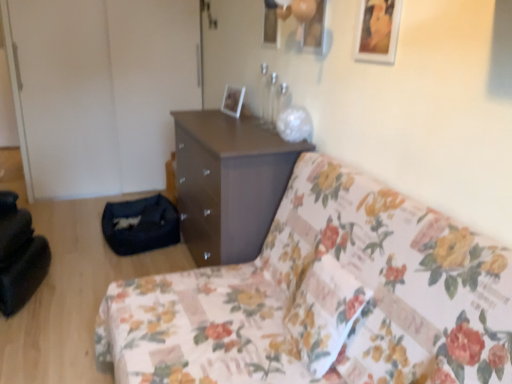
Question: Can you confirm if floral fabric couch at center is positioned to the right of white glossy picture frame at upper center, marked as the 2th picture frame in a right-to-left arrangement?

Choices:
 (A) yes
 (B) no

Answer: (A)

Question: Considering the relative sizes of floral fabric couch at center and white glossy picture frame at upper center, which appears as the first picture frame when viewed from the left, in the image provided, is floral fabric couch at center wider than white glossy picture frame at upper center, which appears as the first picture frame when viewed from the left,?

Choices:
 (A) no
 (B) yes

Answer: (B)

Question: Is floral fabric couch at center beside white glossy picture frame at upper center, which appears as the first picture frame when viewed from the left?

Choices:
 (A) yes
 (B) no

Answer: (B)

Question: From the image's perspective, is floral fabric couch at center located beneath white glossy picture frame at upper center, positioned as the first picture frame in back-to-front order?

Choices:
 (A) no
 (B) yes

Answer: (B)

Question: Is floral fabric couch at center turned away from white glossy picture frame at upper center, which appears as the first picture frame when viewed from the left?

Choices:
 (A) yes
 (B) no

Answer: (B)

Question: Is point (234, 124) closer or farther from the camera than point (228, 102)?

Choices:
 (A) farther
 (B) closer

Answer: (B)

Question: Is matte brown chest of drawers at center spatially inside white glossy picture frame at upper center, acting as the 2th picture frame starting from the front, or outside of it?

Choices:
 (A) inside
 (B) outside

Answer: (B)

Question: In the image, is matte brown chest of drawers at center on the left side or the right side of white glossy picture frame at upper center, marked as the 2th picture frame in a right-to-left arrangement?

Choices:
 (A) right
 (B) left

Answer: (B)

Question: Based on their sizes in the image, would you say matte brown chest of drawers at center is bigger or smaller than white glossy picture frame at upper center, marked as the 2th picture frame in a right-to-left arrangement?

Choices:
 (A) big
 (B) small

Answer: (A)

Question: Is point (287, 193) positioned closer to the camera than point (248, 254)?

Choices:
 (A) farther
 (B) closer

Answer: (B)

Question: Considering their positions, is floral fabric couch at center located in front of or behind matte brown chest of drawers at center?

Choices:
 (A) behind
 (B) front

Answer: (B)

Question: Is floral fabric couch at center wider or thinner than matte brown chest of drawers at center?

Choices:
 (A) thin
 (B) wide

Answer: (B)

Question: Based on their sizes in the image, would you say floral fabric couch at center is bigger or smaller than matte brown chest of drawers at center?

Choices:
 (A) small
 (B) big

Answer: (B)

Question: Visually, is wooden picture frame at upper right, positioned as the 2th picture frame in left-to-right order, positioned to the left or to the right of white glossy picture frame at upper center, which appears as the first picture frame when viewed from the left?

Choices:
 (A) right
 (B) left

Answer: (A)

Question: In the image, is wooden picture frame at upper right, the 2th picture frame from the back, positioned in front of or behind white glossy picture frame at upper center, positioned as the first picture frame in back-to-front order?

Choices:
 (A) behind
 (B) front

Answer: (B)